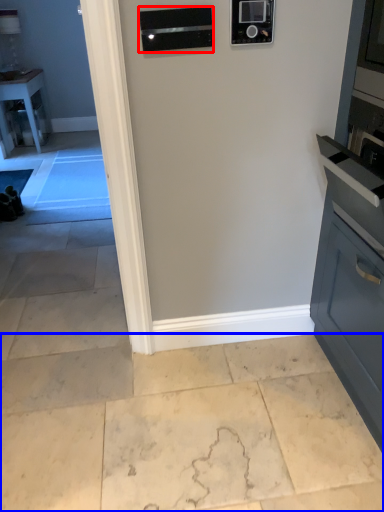
Question: Which object is further to the camera taking this photo, appliance (highlighted by a red box) or concrete (highlighted by a blue box)?

Choices:
 (A) appliance
 (B) concrete

Answer: (A)